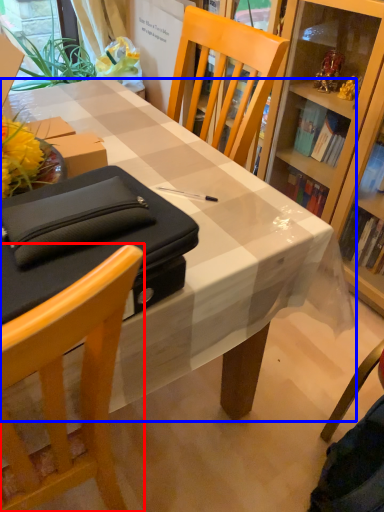
Question: Which of the following is the farthest to the observer, chair (highlighted by a red box) or desk (highlighted by a blue box)?

Choices:
 (A) chair
 (B) desk

Answer: (B)